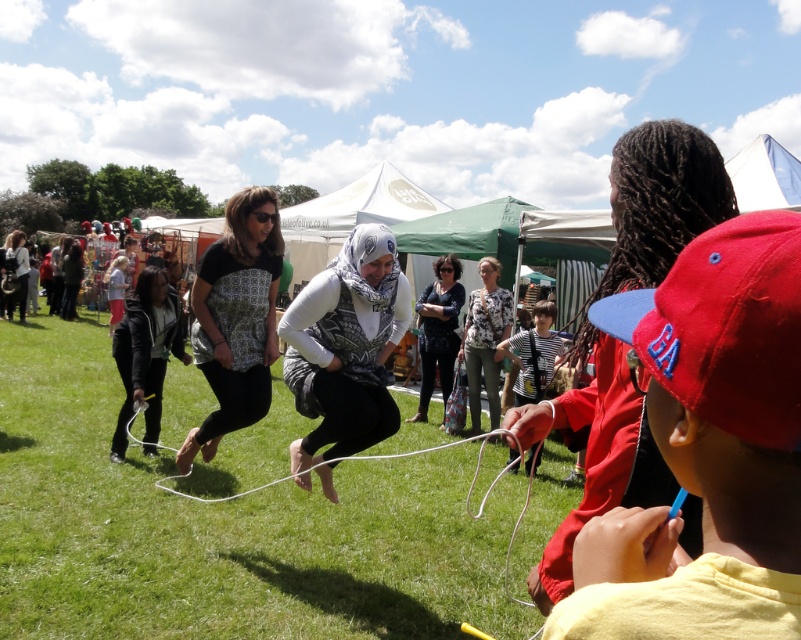
Is red cotton cap at right bigger than white matte scarf at center?

Incorrect, red cotton cap at right is not larger than white matte scarf at center.

Is red cotton cap at right wider than white matte scarf at center?

Incorrect, red cotton cap at right's width does not surpass white matte scarf at center's.

Which is in front, point (711, 577) or point (376, 268)?

Point (711, 577) is more forward.

The height and width of the screenshot is (640, 801). I want to click on red cotton cap at right, so click(x=707, y=445).

Which is above, matte black shirt at center or black matte jacket at left?

matte black shirt at center

Is matte black shirt at center positioned at the back of black matte jacket at left?

No, matte black shirt at center is in front of black matte jacket at left.

Is point (218, 284) positioned behind point (178, 346)?

No.

The height and width of the screenshot is (640, 801). Find the location of `matte black shirt at center`. matte black shirt at center is located at coordinates (236, 317).

Who is higher up, red cotton cap at right or floral shirt at center?

red cotton cap at right is above.

Is point (763, 628) less distant than point (461, 339)?

Yes, point (763, 628) is in front of point (461, 339).

You are a GUI agent. You are given a task and a screenshot of the screen. Output one action in this format:
    pyautogui.click(x=<x>, y=<y>)
    Task: Click on the red cotton cap at right
    
    Given the screenshot: What is the action you would take?
    pyautogui.click(x=707, y=445)